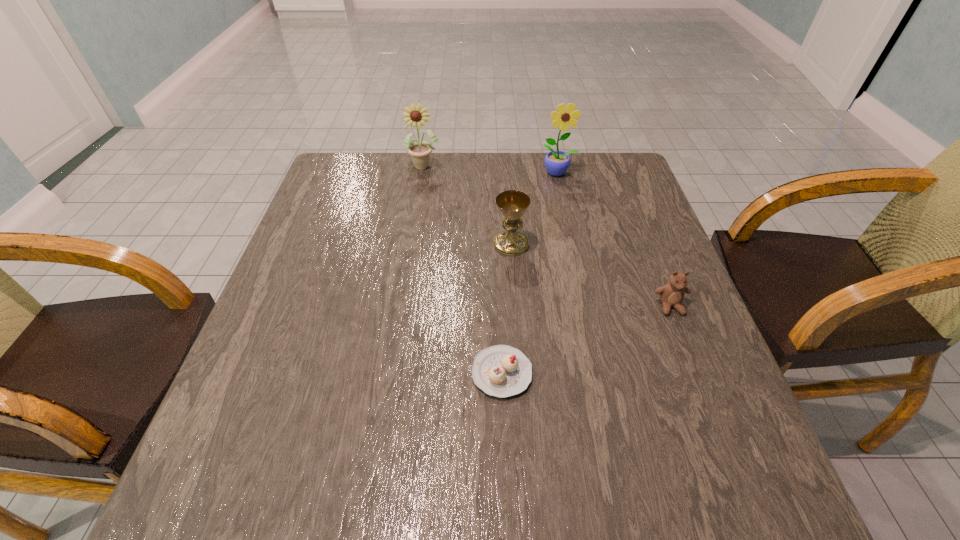
Where is `vacant area between the right sunflower and the third shortest object`? Image resolution: width=960 pixels, height=540 pixels. vacant area between the right sunflower and the third shortest object is located at coordinates (535, 208).

This screenshot has height=540, width=960. What are the coordinates of `free area in between the teddy bear and the leftmost object` in the screenshot? It's located at (547, 236).

Image resolution: width=960 pixels, height=540 pixels. Identify the location of vacant space that is in between the second object from right to left and the cupcake. (530, 273).

Where is `vacant area that lies between the right sunflower and the cupcake`? Image resolution: width=960 pixels, height=540 pixels. vacant area that lies between the right sunflower and the cupcake is located at coordinates (530, 273).

The image size is (960, 540). I want to click on vacant space that's between the fourth farthest object and the third nearest object, so click(x=590, y=275).

Identify the location of free space between the chalice and the fourth farthest object. The height and width of the screenshot is (540, 960). (590, 275).

The width and height of the screenshot is (960, 540). I want to click on vacant area that lies between the fourth object from left to right and the shortest object, so click(x=530, y=273).

Where is `unoccupied area between the second shortest object and the left sunflower`? The image size is (960, 540). unoccupied area between the second shortest object and the left sunflower is located at coordinates (547, 236).

The width and height of the screenshot is (960, 540). Identify the location of vacant area between the fourth object from left to right and the left sunflower. (492, 170).

I want to click on unoccupied area between the nearest object and the leftmost object, so click(x=463, y=269).